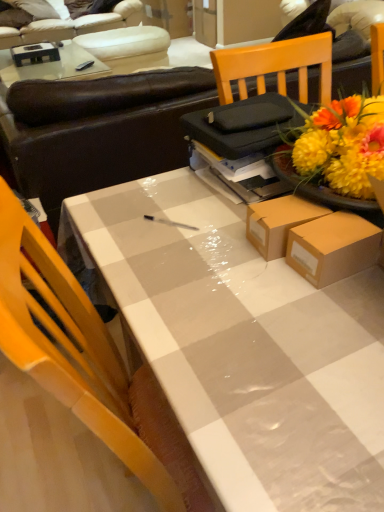
What is the approximate width of white leather couch at upper left, which is counted as the 1th studio couch, starting from the back?

3.49 feet.

From the picture: In order to face white leather couch at upper left, acting as the second studio couch starting from the front, should I rotate leftwards or rightwards?

You should rotate left by 16.442 degrees.

Locate an element on the screen. Image resolution: width=384 pixels, height=512 pixels. white leather couch at upper left, acting as the second studio couch starting from the front is located at coordinates (95, 36).

How distant is white leather couch at upper left, acting as the second studio couch starting from the front, from white leather armchair at upper left?

The distance of white leather couch at upper left, acting as the second studio couch starting from the front, from white leather armchair at upper left is 5.57 inches.

From the image's perspective, which is above, white leather couch at upper left, acting as the second studio couch starting from the front, or white leather armchair at upper left?

white leather couch at upper left, acting as the second studio couch starting from the front.

Is there a large distance between white leather couch at upper left, which ranks as the first studio couch in top-to-bottom order, and white leather armchair at upper left?

No, white leather couch at upper left, which ranks as the first studio couch in top-to-bottom order, is not far away from white leather armchair at upper left.

Looking at this image, considering the relative sizes of white leather couch at upper left, which ranks as the first studio couch in top-to-bottom order, and white leather armchair at upper left in the image provided, is white leather couch at upper left, which ranks as the first studio couch in top-to-bottom order, shorter than white leather armchair at upper left?

Incorrect, the height of white leather couch at upper left, which ranks as the first studio couch in top-to-bottom order, does not fall short of that of white leather armchair at upper left.

Can you confirm if white leather armchair at upper left is thinner than brown leather couch at upper center, the second studio couch viewed from the top?

Yes.

Is white leather armchair at upper left taller than brown leather couch at upper center, the second studio couch when ordered from back to front?

No.

Would you consider white leather armchair at upper left to be distant from brown leather couch at upper center, the second studio couch when ordered from back to front?

Absolutely, white leather armchair at upper left is distant from brown leather couch at upper center, the second studio couch when ordered from back to front.

Is white leather armchair at upper left facing towards brown leather couch at upper center, which ranks as the first studio couch in front-to-back order?

Yes, white leather armchair at upper left faces towards brown leather couch at upper center, which ranks as the first studio couch in front-to-back order.

In the scene shown: What's the angular difference between white glossy table at center and white leather couch at upper left, which is counted as the 1th studio couch, starting from the back,'s facing directions?

There is a 1.86-degree angle between the facing directions of white glossy table at center and white leather couch at upper left, which is counted as the 1th studio couch, starting from the back.

Considering the points (314, 343) and (51, 22), which point is in front, point (314, 343) or point (51, 22)?

Point (314, 343)

Considering the relative positions of white glossy table at center and white leather couch at upper left, the second studio couch positioned from the bottom, in the image provided, is white glossy table at center to the left or to the right of white leather couch at upper left, the second studio couch positioned from the bottom,?

From the image, it's evident that white glossy table at center is to the right of white leather couch at upper left, the second studio couch positioned from the bottom.

Could you tell me if white leather armchair at upper left is facing white leather couch at upper left, acting as the second studio couch starting from the front?

No, white leather armchair at upper left is not turned towards white leather couch at upper left, acting as the second studio couch starting from the front.

Is white leather armchair at upper left placed right next to white leather couch at upper left, acting as the second studio couch starting from the front?

There is a gap between white leather armchair at upper left and white leather couch at upper left, acting as the second studio couch starting from the front.

Considering the sizes of objects white leather armchair at upper left and white leather couch at upper left, which is counted as the 1th studio couch, starting from the back, in the image provided, who is taller, white leather armchair at upper left or white leather couch at upper left, which is counted as the 1th studio couch, starting from the back,?

With more height is white leather couch at upper left, which is counted as the 1th studio couch, starting from the back.

From the picture: From a real-world perspective, is white leather armchair at upper left below white leather couch at upper left, which is counted as the 1th studio couch, starting from the back?

Yes.

Consider the image. From a real-world perspective, is brown leather couch at upper center, which ranks as the first studio couch in front-to-back order, over white leather armchair at upper left?

Yes, from a real-world perspective, brown leather couch at upper center, which ranks as the first studio couch in front-to-back order, is above white leather armchair at upper left.

Is brown leather couch at upper center, the second studio couch when ordered from back to front, taller or shorter than white leather armchair at upper left?

Clearly, brown leather couch at upper center, the second studio couch when ordered from back to front, is taller compared to white leather armchair at upper left.

Considering the sizes of brown leather couch at upper center, the second studio couch viewed from the top, and white leather armchair at upper left in the image, is brown leather couch at upper center, the second studio couch viewed from the top, bigger or smaller than white leather armchair at upper left?

brown leather couch at upper center, the second studio couch viewed from the top, is bigger than white leather armchair at upper left.

Considering the sizes of brown leather couch at upper center, the second studio couch viewed from the top, and white leather armchair at upper left in the image, is brown leather couch at upper center, the second studio couch viewed from the top, wider or thinner than white leather armchair at upper left?

Considering their sizes, brown leather couch at upper center, the second studio couch viewed from the top, looks broader than white leather armchair at upper left.

Who is taller, white leather couch at upper left, which ranks as the first studio couch in top-to-bottom order, or white glossy table at center?

With more height is white glossy table at center.

Consider the image. Would you say white leather couch at upper left, which is counted as the 1th studio couch, starting from the back, is outside white glossy table at center?

white leather couch at upper left, which is counted as the 1th studio couch, starting from the back, is positioned outside white glossy table at center.

From the image's perspective, which one is positioned lower, white leather couch at upper left, acting as the second studio couch starting from the front, or white glossy table at center?

From the image's view, white glossy table at center is below.

Which object is closer to the camera taking this photo, white leather couch at upper left, acting as the second studio couch starting from the front, or white glossy table at center?

white glossy table at center is closer to the camera.

Is the depth of white glossy table at center greater than that of brown leather couch at upper center, the second studio couch viewed from the top?

No, the depth of white glossy table at center is less than that of brown leather couch at upper center, the second studio couch viewed from the top.

Consider the image. Which object is wider, white glossy table at center or brown leather couch at upper center, arranged as the first studio couch when ordered from the bottom?

brown leather couch at upper center, arranged as the first studio couch when ordered from the bottom, is wider.

Considering the relative sizes of white glossy table at center and brown leather couch at upper center, the second studio couch viewed from the top, in the image provided, is white glossy table at center bigger than brown leather couch at upper center, the second studio couch viewed from the top,?

No, white glossy table at center is not bigger than brown leather couch at upper center, the second studio couch viewed from the top.

Is brown leather couch at upper center, arranged as the first studio couch when ordered from the bottom, surrounded by white glossy table at center?

No.

The height and width of the screenshot is (512, 384). I want to click on studio couch behind the white leather armchair at upper left, so click(95, 36).

Where is `studio couch below the white leather armchair at upper left (from the image's perspective)`? This screenshot has width=384, height=512. studio couch below the white leather armchair at upper left (from the image's perspective) is located at coordinates (99, 130).

Which object lies further to the anchor point white leather armchair at upper left, white glossy table at center or white leather couch at upper left, which is counted as the 1th studio couch, starting from the back?

white glossy table at center lies further to white leather armchair at upper left than the other object.

Estimate the real-world distances between objects in this image. Which object is closer to white leather armchair at upper left, brown leather couch at upper center, which ranks as the first studio couch in front-to-back order, or white glossy table at center?

brown leather couch at upper center, which ranks as the first studio couch in front-to-back order, is closer to white leather armchair at upper left.

When comparing their distances from white glossy table at center, does white leather armchair at upper left or white leather couch at upper left, which ranks as the first studio couch in top-to-bottom order, seem further?

Among the two, white leather couch at upper left, which ranks as the first studio couch in top-to-bottom order, is located further to white glossy table at center.

Based on their spatial positions, is brown leather couch at upper center, arranged as the first studio couch when ordered from the bottom, or white glossy table at center closer to white leather couch at upper left, which is counted as the 1th studio couch, starting from the back?

brown leather couch at upper center, arranged as the first studio couch when ordered from the bottom.

Based on their spatial positions, is brown leather couch at upper center, which ranks as the first studio couch in front-to-back order, or white leather armchair at upper left further from white leather couch at upper left, which is counted as the 1th studio couch, starting from the back?

brown leather couch at upper center, which ranks as the first studio couch in front-to-back order, is further to white leather couch at upper left, which is counted as the 1th studio couch, starting from the back.

Which object lies nearer to the anchor point brown leather couch at upper center, arranged as the first studio couch when ordered from the bottom, white leather armchair at upper left or white leather couch at upper left, which is counted as the 1th studio couch, starting from the back?

Based on the image, white leather armchair at upper left appears to be nearer to brown leather couch at upper center, arranged as the first studio couch when ordered from the bottom.

Estimate the real-world distances between objects in this image. Which object is further from white leather armchair at upper left, white glossy table at center or brown leather couch at upper center, the second studio couch when ordered from back to front?

The object further to white leather armchair at upper left is white glossy table at center.

From the image, which object appears to be nearer to white glossy table at center, white leather couch at upper left, which ranks as the first studio couch in top-to-bottom order, or white leather armchair at upper left?

white leather armchair at upper left is positioned closer to the anchor white glossy table at center.

Find the location of a particular element. This screenshot has width=384, height=512. armchair between brown leather couch at upper center, which ranks as the first studio couch in front-to-back order, and white leather couch at upper left, acting as the second studio couch starting from the front, in the front-back direction is located at coordinates (128, 47).

Where is `armchair between white glossy table at center and white leather couch at upper left, which ranks as the first studio couch in top-to-bottom order, from front to back`? armchair between white glossy table at center and white leather couch at upper left, which ranks as the first studio couch in top-to-bottom order, from front to back is located at coordinates (128, 47).

You are a GUI agent. You are given a task and a screenshot of the screen. Output one action in this format:
    pyautogui.click(x=<x>, y=<y>)
    Task: Click on the studio couch located between white glossy table at center and white leather couch at upper left, acting as the second studio couch starting from the front, in the depth direction
    This screenshot has width=384, height=512.
    Given the screenshot: What is the action you would take?
    pyautogui.click(x=99, y=130)

Where is `studio couch between white glossy table at center and white leather armchair at upper left in the front-back direction`? Image resolution: width=384 pixels, height=512 pixels. studio couch between white glossy table at center and white leather armchair at upper left in the front-back direction is located at coordinates (99, 130).